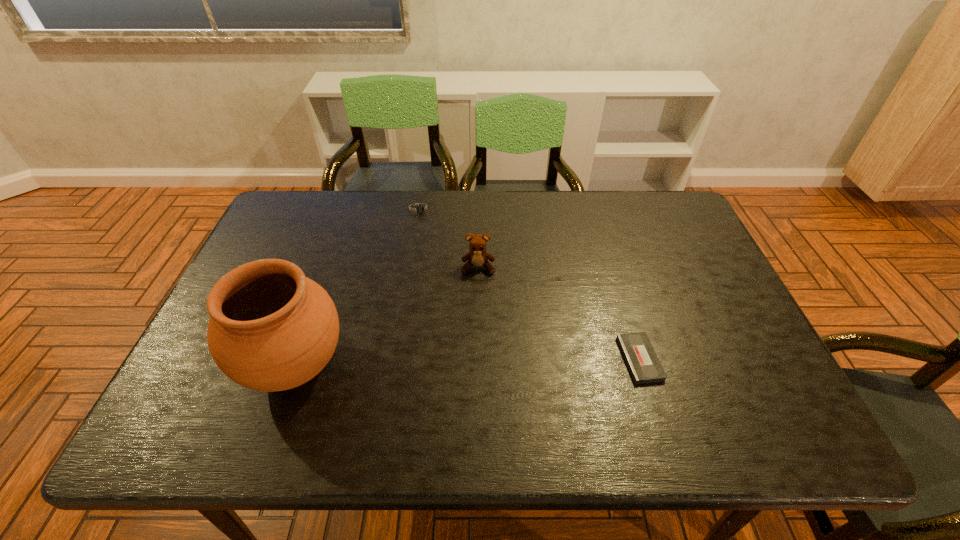
Identify the location of vacant spot on the desktop that is between the pottery and the rightmost object and is positioned on the front-facing side of the third shortest object. This screenshot has width=960, height=540. (475, 362).

Identify the location of vacant space on the desktop that is between the pottery and the shortest object and is positioned on the face of the watch. (459, 363).